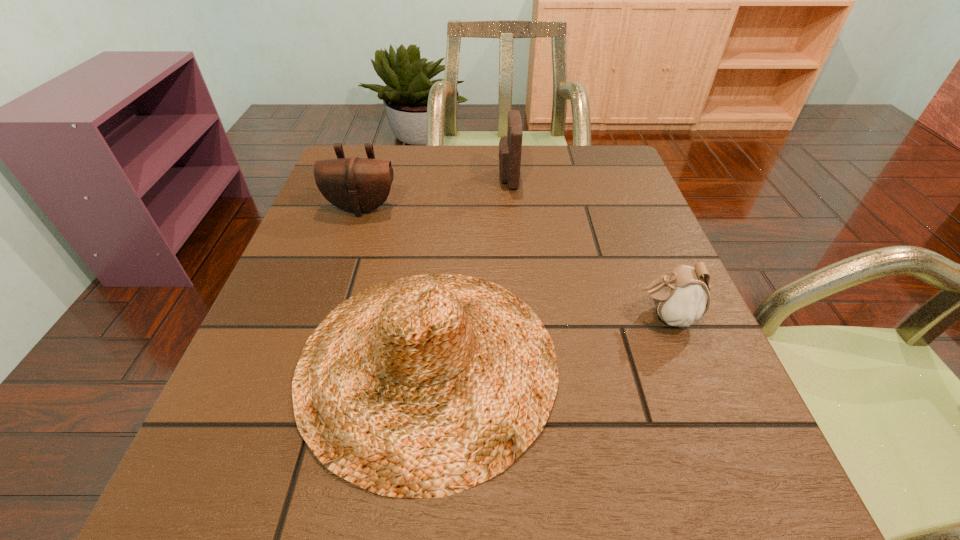
Find the location of a particular element. free space located 0.350m with the flap open on the second farthest pouch is located at coordinates (318, 341).

Locate an element on the screen. vacant area situated on the back of the sunhat is located at coordinates (441, 240).

Locate an element on the screen. Image resolution: width=960 pixels, height=540 pixels. free space located 0.330m on the front-facing side of the rightmost object is located at coordinates (451, 316).

This screenshot has width=960, height=540. I want to click on free space located on the front-facing side of the rightmost object, so click(602, 316).

Identify the location of vacant space positioned on the front-facing side of the rightmost object. The height and width of the screenshot is (540, 960). (580, 316).

I want to click on object located at the far edge, so click(510, 146).

At what (x,y) coordinates should I click in order to perform the action: click on object located at the near edge. Please return your answer as a coordinate pair (x, y). Looking at the image, I should click on (421, 387).

Locate an element on the screen. pouch positioned at the left edge is located at coordinates (358, 185).

You are a GUI agent. You are given a task and a screenshot of the screen. Output one action in this format:
    pyautogui.click(x=<x>, y=<y>)
    Task: Click on the sunhat located at the left edge
    The width and height of the screenshot is (960, 540).
    Given the screenshot: What is the action you would take?
    pyautogui.click(x=421, y=387)

The height and width of the screenshot is (540, 960). I want to click on object located at the right edge, so click(681, 297).